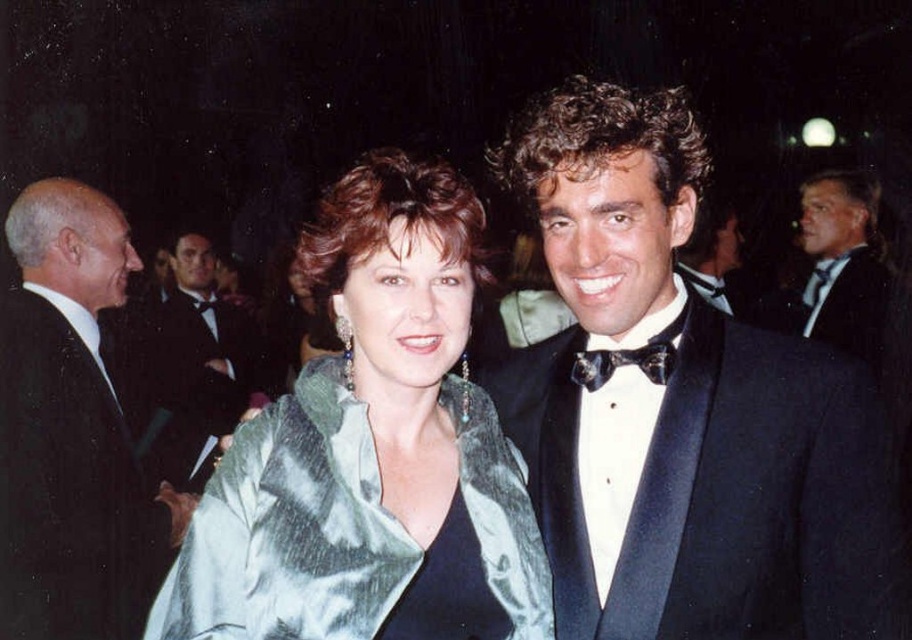
Who is lower down, black satin tuxedo at center or black satin suit at left?

black satin suit at left is lower down.

Where is `black satin tuxedo at center`? The image size is (912, 640). black satin tuxedo at center is located at coordinates (684, 410).

Find the location of a particular element. The width and height of the screenshot is (912, 640). black satin tuxedo at center is located at coordinates (684, 410).

Which is in front, point (475, 404) or point (40, 333)?

Positioned in front is point (475, 404).

Does satin green coat at center have a lesser width compared to black satin suit at left?

No, satin green coat at center is not thinner than black satin suit at left.

Between point (527, 577) and point (57, 212), which one is positioned in front?

Point (527, 577)

Find the location of `satin green coat at center`. satin green coat at center is located at coordinates (371, 452).

Between point (232, 396) and point (617, 356), which one is positioned in front?

Point (617, 356)

Between point (174, 397) and point (609, 376), which one is positioned in front?

Point (609, 376)

Identify the location of shiny black tuxedo at center. (198, 362).